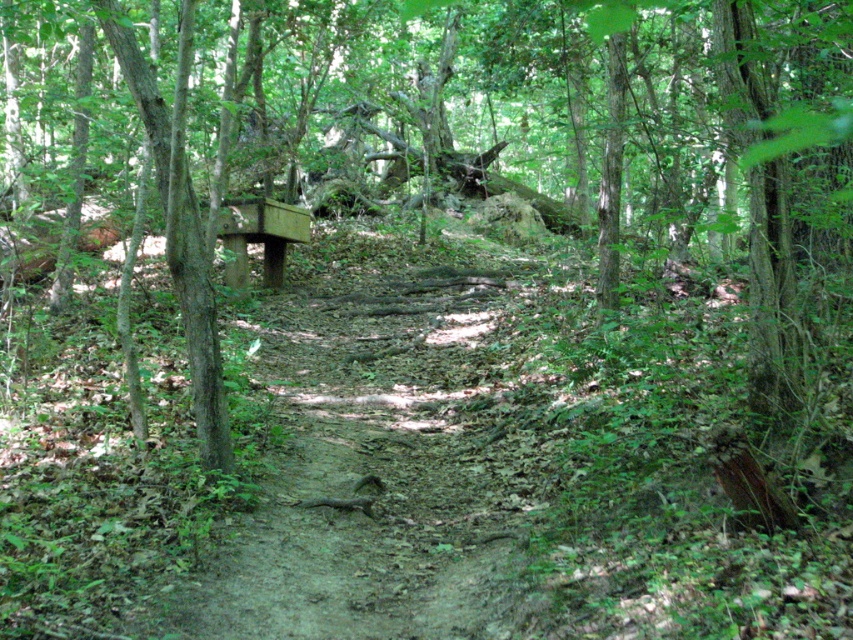
Between smooth brown tree trunk at left and wooden bench at center, which one has less height?

Standing shorter between the two is wooden bench at center.

Which is more to the right, smooth brown tree trunk at left or wooden bench at center?

smooth brown tree trunk at left

I want to click on smooth brown tree trunk at left, so click(x=178, y=225).